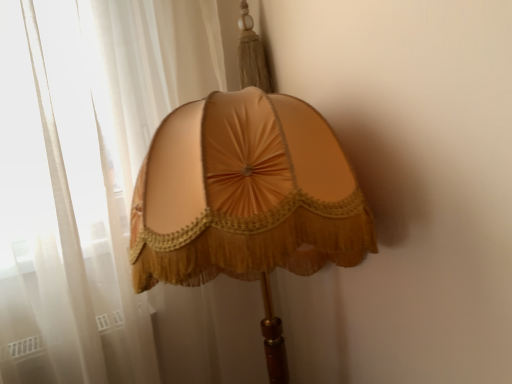
What is the approximate width of satin orange lampshade at center?

satin orange lampshade at center is 20.74 inches in width.

What do you see at coordinates (246, 199) in the screenshot? I see `satin orange lampshade at center` at bounding box center [246, 199].

The width and height of the screenshot is (512, 384). What are the coordinates of `satin orange lampshade at center` in the screenshot? It's located at (246, 199).

Consider the image. In order to face satin orange lampshade at center, should I rotate leftwards or rightwards?

You should look right and rotate roughly 0.172 degrees.

Find the location of `satin orange lampshade at center`. satin orange lampshade at center is located at coordinates (246, 199).